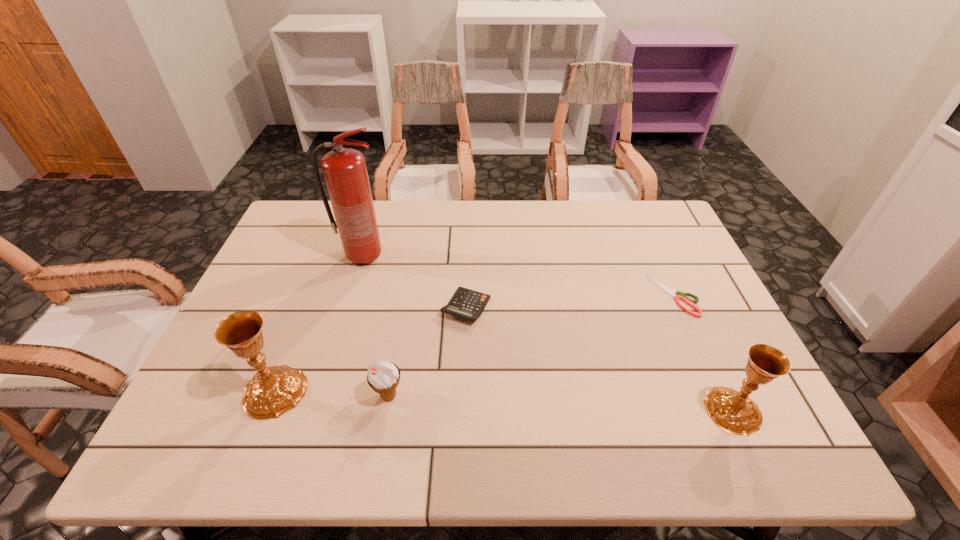
Find the location of a particular element. This screenshot has height=540, width=960. scissors located at the right edge is located at coordinates (680, 295).

Locate an element on the screen. The width and height of the screenshot is (960, 540). object located at the near left corner is located at coordinates (274, 390).

The height and width of the screenshot is (540, 960). Find the location of `object located in the near right corner section of the desktop`. object located in the near right corner section of the desktop is located at coordinates (733, 411).

Identify the location of free space at the far edge of the desktop. The image size is (960, 540). (611, 243).

Identify the location of vacant space at the near edge of the desktop. Image resolution: width=960 pixels, height=540 pixels. (638, 406).

At what (x,y) coordinates should I click in order to perform the action: click on vacant space at the right edge of the desktop. Please return your answer as a coordinate pair (x, y). This screenshot has width=960, height=540. Looking at the image, I should click on (700, 348).

Find the location of a particular element. The image size is (960, 540). vacant region at the far right corner of the desktop is located at coordinates (622, 205).

Find the location of `vacant space that's between the third shortest object and the third tallest object`. vacant space that's between the third shortest object and the third tallest object is located at coordinates (561, 403).

Where is `free spot between the shortest object and the icecream`? free spot between the shortest object and the icecream is located at coordinates (532, 346).

At what (x,y) coordinates should I click in order to perform the action: click on free space between the fire extinguisher and the right chalice. Please return your answer as a coordinate pair (x, y). Looking at the image, I should click on (548, 333).